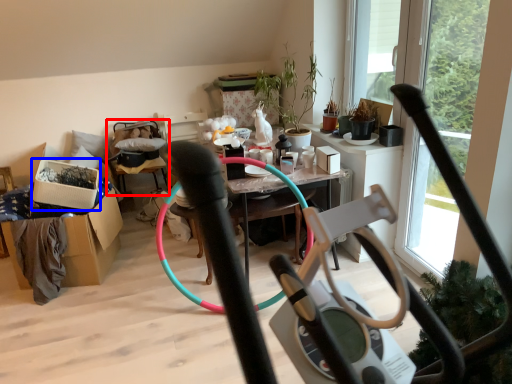
Question: Which object is further to the camera taking this photo, armchair (highlighted by a red box) or box (highlighted by a blue box)?

Choices:
 (A) armchair
 (B) box

Answer: (A)